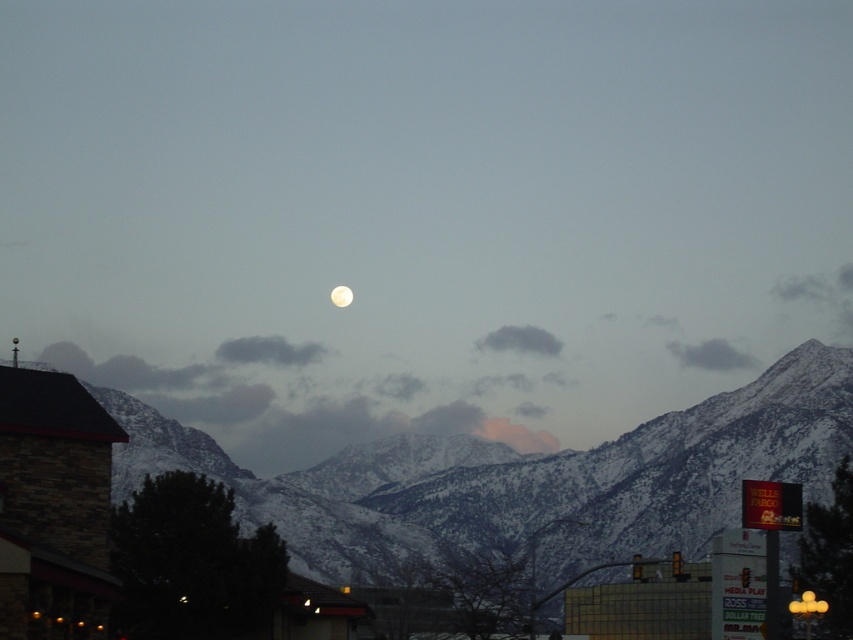
At what (x,y) coordinates should I click in order to perform the action: click on snowy mountain range at center. Please return your answer as a coordinate pair (x, y). This screenshot has width=853, height=640. Looking at the image, I should click on (527, 477).

Who is positioned more to the left, snowy mountain range at center or white glossy moon at upper center?

white glossy moon at upper center

Between point (349, 524) and point (332, 289), which one is positioned behind?

The point (332, 289) is behind.

Find the location of a particular element. The height and width of the screenshot is (640, 853). snowy mountain range at center is located at coordinates (527, 477).